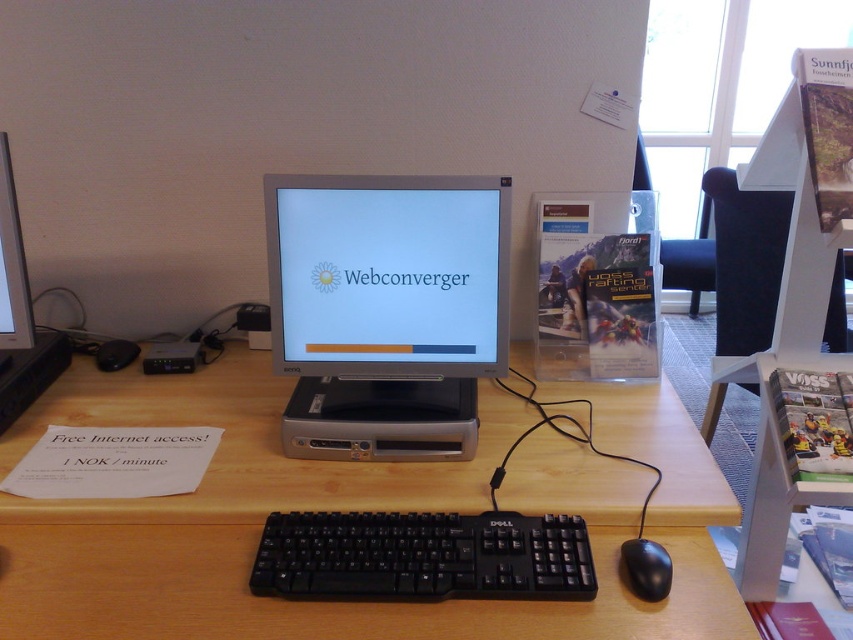
You are setting up a new workstation and want to place a decorative item between the matte silver monitor at center and the black matte mouse at lower right. Considering their widths, which object should you place closer to the edge of the desk to ensure the decorative item fits snugly between them?

Since the matte silver monitor at center is wider than the black matte mouse at lower right, you should place the wider matte silver monitor at center closer to the edge to create enough space for the decorative item between them.

What object is located at the coordinates point [10,264] on the computer workstation setup?

The point [10,264] corresponds to the matte silver monitor at center.

You are a customer at a public internet cafe and need to use the computer. The wooden at center is the desk. The keyboard and mouse are placed on the desk. How far apart are the keyboard and mouse from the wooden desk at center?

The keyboard and mouse are placed on the wooden desk at center, so they are 0 inches apart from the desk. The 32.10 inches distance is between the keyboard and mouse themselves.